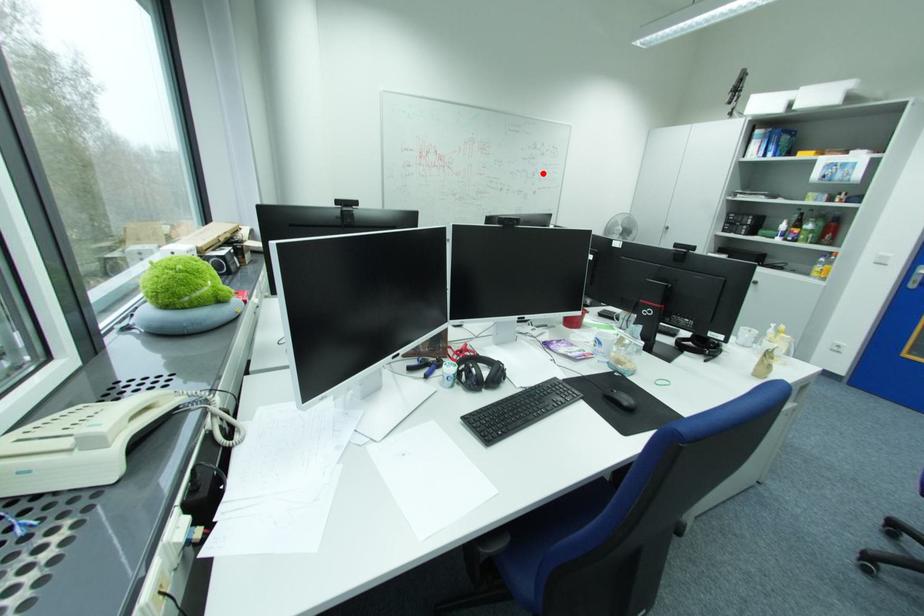
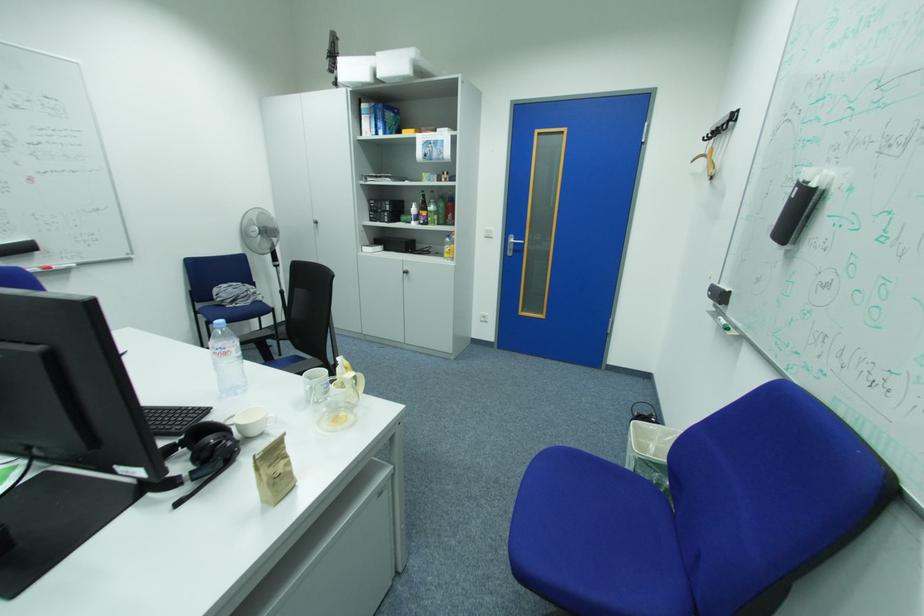
Question: A red point is marked in image1. In image2, is the corresponding 3D point closer to the camera or farther? Reply with the corresponding letter.

Choices:
 (A) The corresponding 3D point is closer.
 (B) The corresponding 3D point is farther.

Answer: (B)